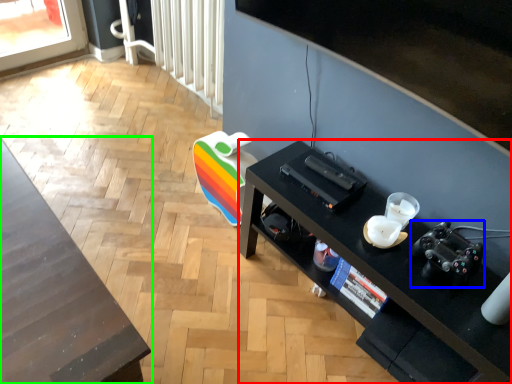
Question: Considering the real-world distances, which object is farthest from desk (highlighted by a red box)? video camera (highlighted by a blue box) or table (highlighted by a green box)?

Choices:
 (A) video camera
 (B) table

Answer: (B)